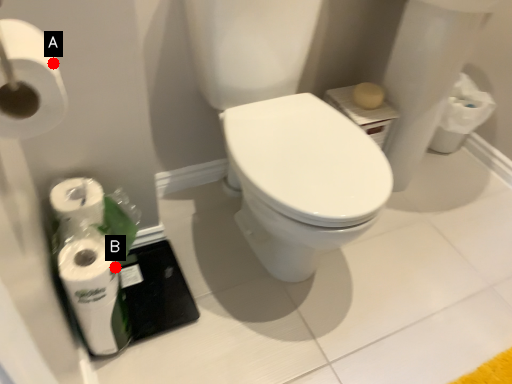
Question: Two points are circled on the image, labeled by A and B beside each circle. Among these points, which one is farthest from the camera?

Choices:
 (A) A is further
 (B) B is further

Answer: (B)